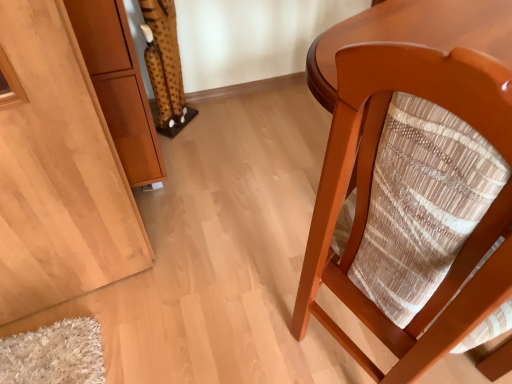
The width and height of the screenshot is (512, 384). Describe the element at coordinates (416, 204) in the screenshot. I see `wooden woven chair at right` at that location.

Where is `wooden woven chair at right`? wooden woven chair at right is located at coordinates (416, 204).

Image resolution: width=512 pixels, height=384 pixels. In order to click on wooden woven chair at right in this screenshot , I will do `click(416, 204)`.